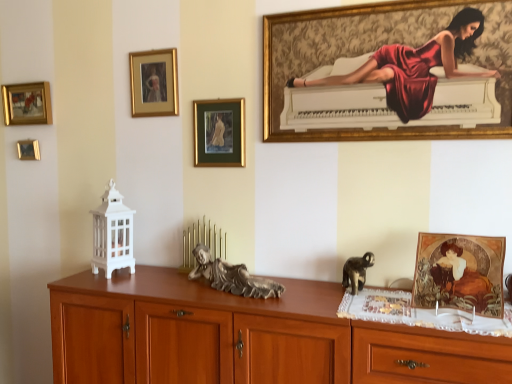
Question: From a real-world perspective, is gold-framed painting at upper left, which ranks as the second picture frame in left-to-right order, physically below silver metallic statue at center, positioned as the first animal in left-to-right order?

Choices:
 (A) no
 (B) yes

Answer: (A)

Question: Is gold-framed painting at upper left, marked as the fourth picture frame in a right-to-left arrangement, bigger than silver metallic statue at center, positioned as the first animal in left-to-right order?

Choices:
 (A) yes
 (B) no

Answer: (B)

Question: Does gold-framed painting at upper left, the 2th picture frame when ordered from back to front, have a smaller size compared to silver metallic statue at center, the 2th animal in the right-to-left sequence?

Choices:
 (A) yes
 (B) no

Answer: (A)

Question: Is the depth of gold-framed painting at upper left, marked as the 4th picture frame in a front-to-back arrangement, greater than that of silver metallic statue at center, positioned as the first animal in left-to-right order?

Choices:
 (A) no
 (B) yes

Answer: (B)

Question: From the image's perspective, is gold-framed painting at upper left, which ranks as the second picture frame in left-to-right order, located beneath silver metallic statue at center, positioned as the first animal in left-to-right order?

Choices:
 (A) no
 (B) yes

Answer: (A)

Question: Is gold-framed painting at upper left, marked as the 4th picture frame in a front-to-back arrangement, wider or thinner than silver metallic statue at center, positioned as the first animal in left-to-right order?

Choices:
 (A) thin
 (B) wide

Answer: (A)

Question: Considering the positions of gold-framed painting at upper left, marked as the 4th picture frame in a front-to-back arrangement, and silver metallic statue at center, the 2th animal in the right-to-left sequence, in the image, is gold-framed painting at upper left, marked as the 4th picture frame in a front-to-back arrangement, bigger or smaller than silver metallic statue at center, the 2th animal in the right-to-left sequence,?

Choices:
 (A) small
 (B) big

Answer: (A)

Question: In the image, is gold-framed painting at upper left, which ranks as the second picture frame in left-to-right order, positioned in front of or behind silver metallic statue at center, positioned as the first animal in left-to-right order?

Choices:
 (A) front
 (B) behind

Answer: (B)

Question: From the image's perspective, is gold-framed painting at upper left, the 2th picture frame when ordered from back to front, positioned above or below silver metallic statue at center, the 2th animal in the right-to-left sequence?

Choices:
 (A) above
 (B) below

Answer: (A)

Question: In terms of height, does wooden drawer at lower right look taller or shorter compared to gold-framed painting at upper center, the second picture frame in the right-to-left sequence?

Choices:
 (A) short
 (B) tall

Answer: (B)

Question: Considering their positions, is wooden drawer at lower right located in front of or behind gold-framed painting at upper center, arranged as the 4th picture frame when viewed from the left?

Choices:
 (A) behind
 (B) front

Answer: (B)

Question: Considering the positions of point (387, 372) and point (219, 145), is point (387, 372) closer or farther from the camera than point (219, 145)?

Choices:
 (A) closer
 (B) farther

Answer: (A)

Question: Considering the positions of wooden drawer at lower right and gold-framed painting at upper center, the second picture frame in the right-to-left sequence, in the image, is wooden drawer at lower right wider or thinner than gold-framed painting at upper center, the second picture frame in the right-to-left sequence,?

Choices:
 (A) wide
 (B) thin

Answer: (A)

Question: Based on their positions, is wooden drawer at lower right located to the left or right of brown wooden chest of drawers at center?

Choices:
 (A) left
 (B) right

Answer: (B)

Question: From the image's perspective, is wooden drawer at lower right above or below brown wooden chest of drawers at center?

Choices:
 (A) below
 (B) above

Answer: (B)